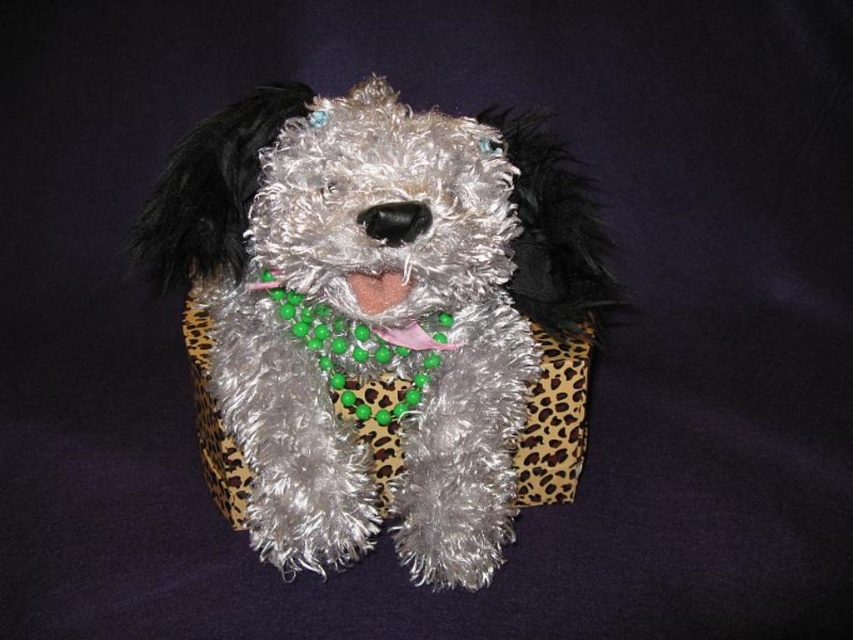
You are a child who wants to reach the green beaded necklace at center on the toy. If your hand can extend 80 centimeters, can you reach it?

The green beaded necklace at center is 91.38 centimeters away from the viewer. Since your hand can only extend 80 centimeters, you cannot reach the green beaded necklace at center.

You are looking at the plush dog toy and want to place a sticker on the point that is closer to you. Which point should you choose between point [277,285] and point [370,300]?

Point [277,285] is closer to you than point [370,300], so you should choose point [277,285] to place the sticker.